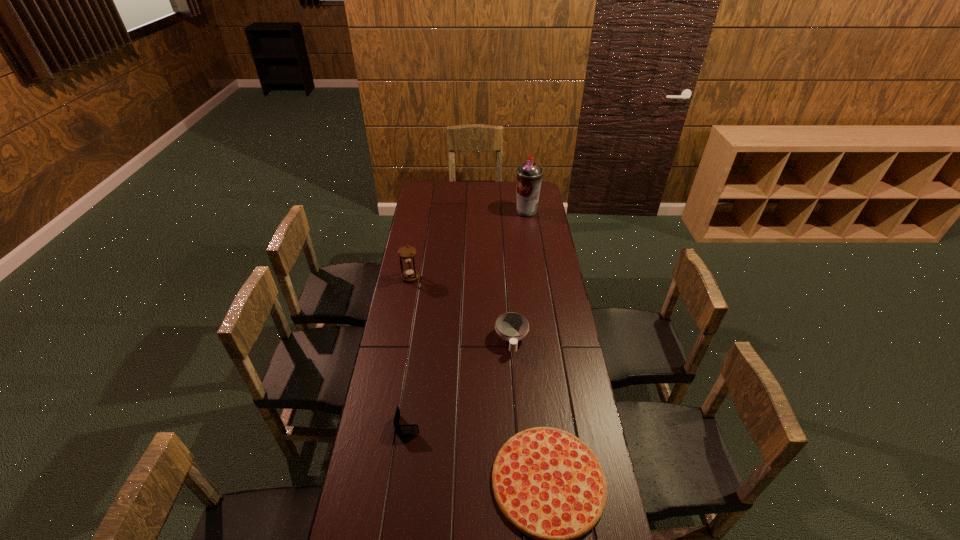
Where is `free space between the third farthest object and the hourglass`? free space between the third farthest object and the hourglass is located at coordinates (461, 309).

Identify the location of free space between the fourth shortest object and the farthest object. (468, 245).

Where is `unoccupied area between the second shortest object and the third nearest object`? unoccupied area between the second shortest object and the third nearest object is located at coordinates [x=460, y=382].

This screenshot has width=960, height=540. I want to click on unoccupied position between the leftmost object and the farthest object, so click(468, 245).

Find the location of `object that stands as the closest to the chinaware`. object that stands as the closest to the chinaware is located at coordinates (549, 484).

This screenshot has width=960, height=540. I want to click on object that is the third closest to the hourglass, so click(x=408, y=429).

Locate an element on the screen. The height and width of the screenshot is (540, 960). blank space that satisfies the following two spatial constraints: 1. on the front side of the tallest object; 2. on the outer surface of the wallet is located at coordinates (558, 424).

This screenshot has width=960, height=540. What are the coordinates of `vacant space that satisfies the following two spatial constraints: 1. on the side with the handle of the chinaware; 2. on the outer surface of the second shortest object` in the screenshot? It's located at (517, 424).

The height and width of the screenshot is (540, 960). I want to click on vacant space that satisfies the following two spatial constraints: 1. on the side with the handle of the third tallest object; 2. on the outer surface of the fourth tallest object, so click(517, 424).